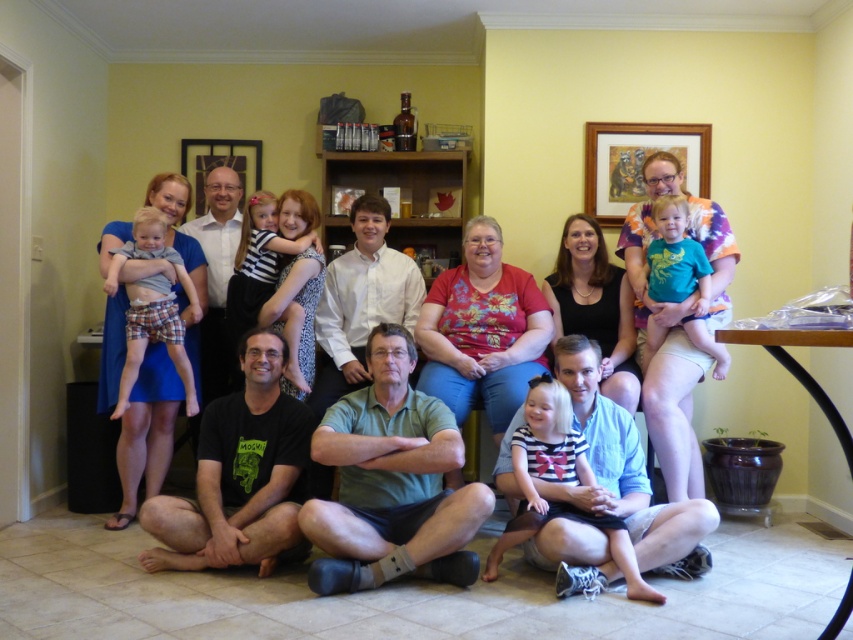
Question: Which point appears closest to the camera in this image?

Choices:
 (A) (596, 147)
 (B) (463, 564)
 (C) (526, 445)

Answer: (B)

Question: Which point is farther from the camera taking this photo?

Choices:
 (A) [711, 280]
 (B) [521, 480]
 (C) [675, 163]

Answer: (C)

Question: Can you confirm if green cotton shirt at center is smaller than floral fabric shirt at center?

Choices:
 (A) yes
 (B) no

Answer: (A)

Question: Does black t-shirt at lower center have a smaller size compared to plaid fabric shorts at left?

Choices:
 (A) no
 (B) yes

Answer: (A)

Question: In this image, where is green cotton shirt at center located relative to striped cotton shirt at lower center?

Choices:
 (A) left
 (B) right

Answer: (A)

Question: Based on their relative distances, which object is nearer to the black t-shirt at lower center?

Choices:
 (A) matte black shirt at center
 (B) plaid fabric shorts at left
 (C) wooden picture frame at upper center
 (D) green cotton shirt at center

Answer: (D)